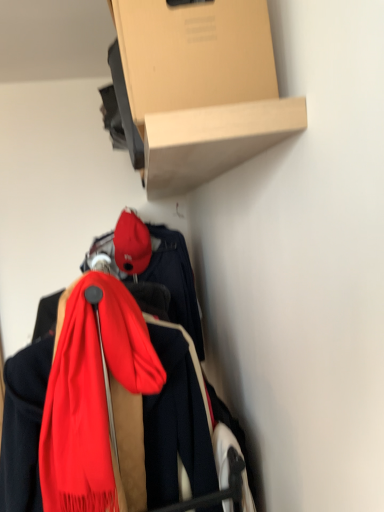
Question: Is cardboard box at upper center positioned far away from matte red cap at center?

Choices:
 (A) yes
 (B) no

Answer: (A)

Question: From the image's perspective, is cardboard box at upper center under matte red cap at center?

Choices:
 (A) yes
 (B) no

Answer: (B)

Question: Is cardboard box at upper center to the left of matte red cap at center from the viewer's perspective?

Choices:
 (A) yes
 (B) no

Answer: (B)

Question: Is cardboard box at upper center next to matte red cap at center and touching it?

Choices:
 (A) yes
 (B) no

Answer: (B)

Question: Is cardboard box at upper center facing towards matte red cap at center?

Choices:
 (A) yes
 (B) no

Answer: (B)

Question: Looking at the image, does cardboard box at upper center seem bigger or smaller compared to silky red scarf at center?

Choices:
 (A) small
 (B) big

Answer: (B)

Question: From a real-world perspective, relative to silky red scarf at center, is cardboard box at upper center vertically above or below?

Choices:
 (A) above
 (B) below

Answer: (A)

Question: Which is correct: cardboard box at upper center is inside silky red scarf at center, or outside of it?

Choices:
 (A) inside
 (B) outside

Answer: (B)

Question: In terms of height, does cardboard box at upper center look taller or shorter compared to silky red scarf at center?

Choices:
 (A) tall
 (B) short

Answer: (B)

Question: Considering the positions of matte red cap at center and silky red scarf at center in the image, is matte red cap at center wider or thinner than silky red scarf at center?

Choices:
 (A) thin
 (B) wide

Answer: (A)

Question: In terms of size, does matte red cap at center appear bigger or smaller than silky red scarf at center?

Choices:
 (A) small
 (B) big

Answer: (A)

Question: Is point (117, 244) closer or farther from the camera than point (61, 503)?

Choices:
 (A) farther
 (B) closer

Answer: (A)

Question: From a real-world perspective, is matte red cap at center above or below silky red scarf at center?

Choices:
 (A) below
 (B) above

Answer: (B)

Question: Is point (122, 218) closer or farther from the camera than point (203, 101)?

Choices:
 (A) closer
 (B) farther

Answer: (B)

Question: Is matte red cap at center to the left or to the right of cardboard box at upper center in the image?

Choices:
 (A) right
 (B) left

Answer: (B)